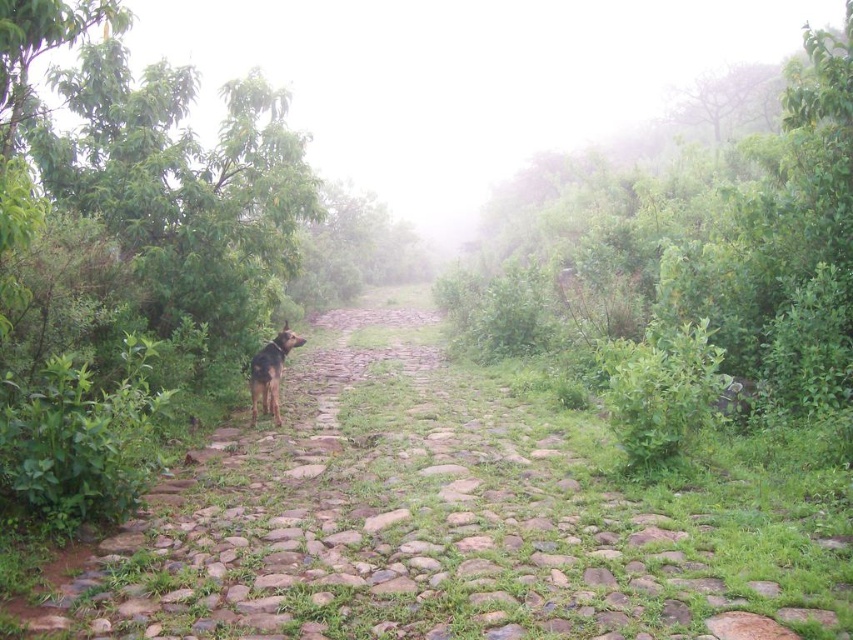
You are a hiker trying to follow the path in this misty forest. You see the green grassy trail at center and the brown fur dog at left. Which direction should you go to stay on the path?

The green grassy trail at center is in front of the brown fur dog at left, so you should go forward towards the green grassy trail at center to stay on the path.

You are a hiker planning to walk along the green grassy trail at center with your brown fur dog at left. Since the dog is 50 cm wide, will there be enough space for both of you to walk side by side on the trail?

The green grassy trail at center is wider than the brown fur dog at left, so yes, there should be enough space for both you and your brown fur dog at left to walk side by side on the trail.

You are a hiker who wants to walk along the path. Can you walk on the green grassy trail at center without stepping on the brown fur dog at left?

The green grassy trail at center is bigger than the brown fur dog at left, so yes, you can walk on the green grassy trail at center without stepping on the brown fur dog at left as there is enough space.